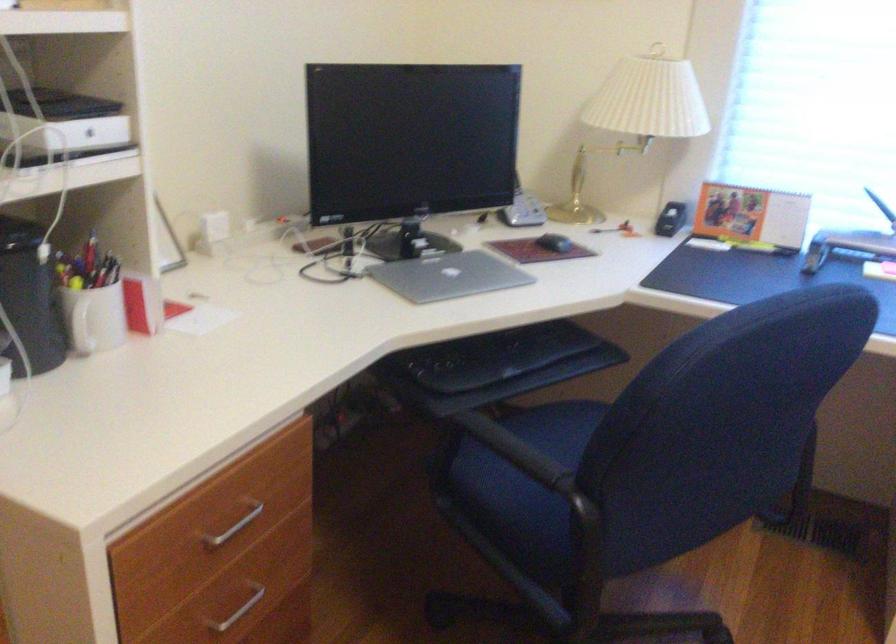
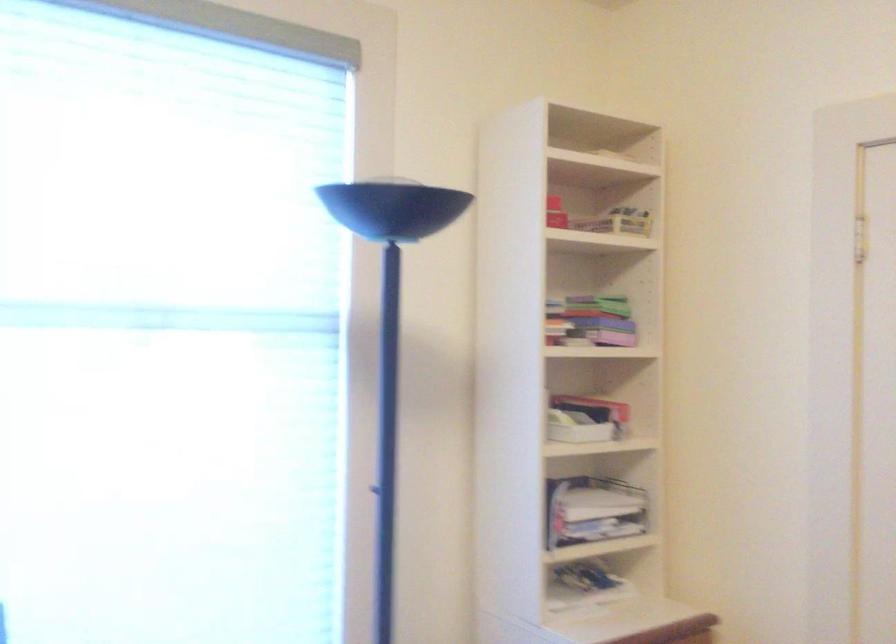
Question: The camera is either moving clockwise (left) or counter-clockwise (right) around the object. The first image is from the beginning of the video and the second image is from the end. Is the camera moving left or right when shooting the video?

Choices:
 (A) Left
 (B) Right

Answer: (A)